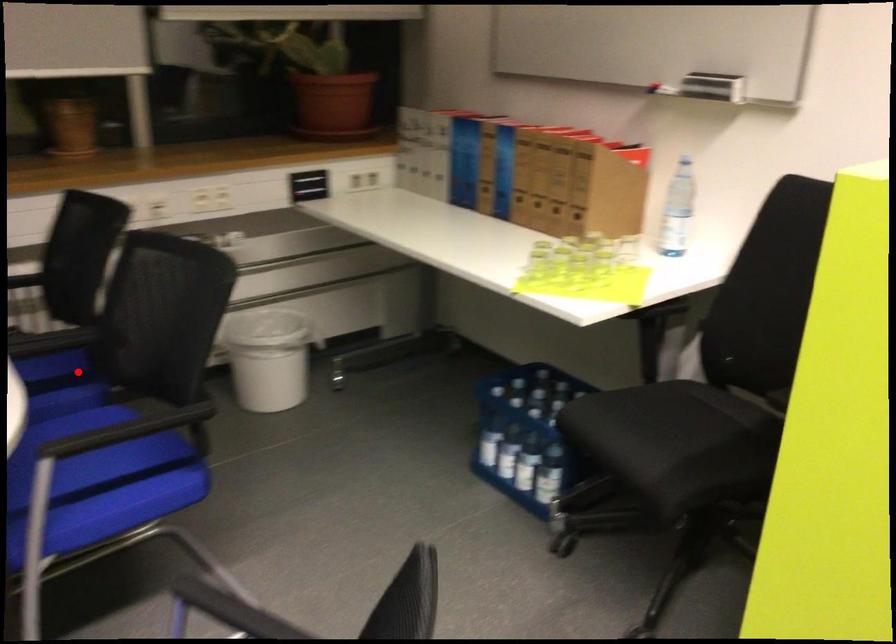
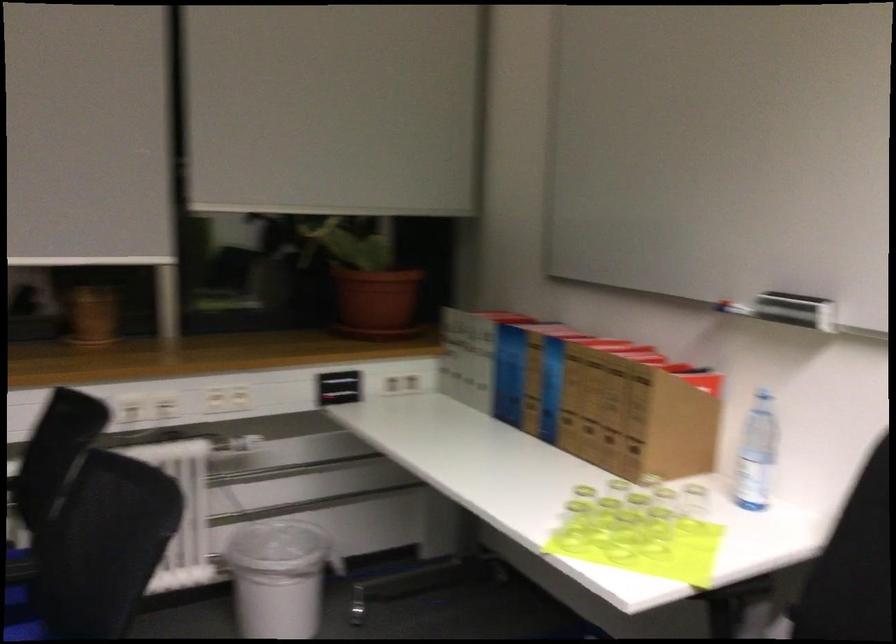
Find the pixel in the second image that matches the highlighted location in the first image.

(23, 603)